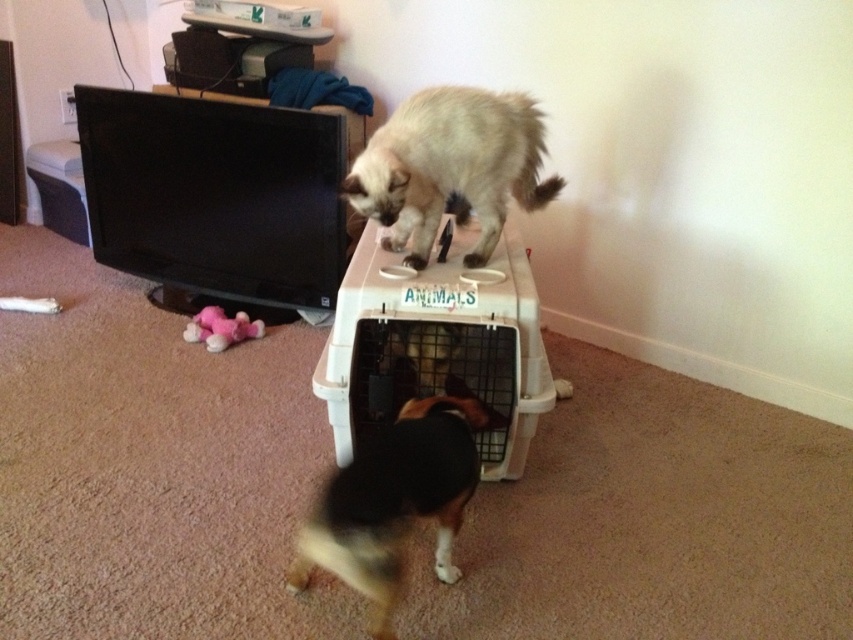
Question: Estimate the real-world distances between objects in this image. Which object is farther from the light brown fur at upper center?

Choices:
 (A) pink plush toy at lower left
 (B) brown and white fur dog at center

Answer: (A)

Question: Does brown and white fur dog at center have a smaller size compared to pink plush toy at lower left?

Choices:
 (A) no
 (B) yes

Answer: (A)

Question: Is brown and white fur dog at center closer to the viewer compared to pink plush toy at lower left?

Choices:
 (A) yes
 (B) no

Answer: (A)

Question: Which object is closer to the camera taking this photo?

Choices:
 (A) brown and white fur dog at center
 (B) pink plush toy at lower left

Answer: (A)

Question: Is brown and white fur dog at center below pink plush toy at lower left?

Choices:
 (A) no
 (B) yes

Answer: (B)

Question: Estimate the real-world distances between objects in this image. Which object is farther from the pink plush toy at lower left?

Choices:
 (A) light brown fur at upper center
 (B) brown and white fur dog at center

Answer: (B)